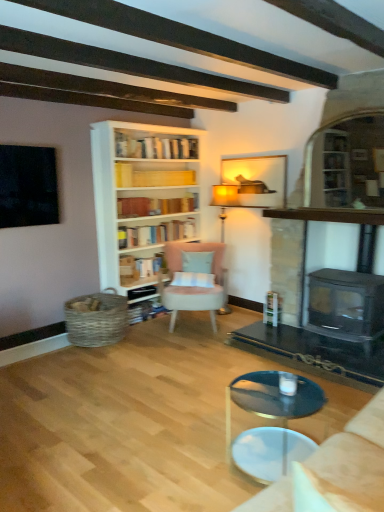
Measure the distance between point (50, 150) and camera.

The depth of point (50, 150) is 3.92 meters.

What is the approximate height of hardcover book at center, marked as the 3th book in a top-to-bottom arrangement?

The height of hardcover book at center, marked as the 3th book in a top-to-bottom arrangement, is 9.67 inches.

The image size is (384, 512). What are the coordinates of `hardcover book at center, marked as the 3th book in a top-to-bottom arrangement` in the screenshot? It's located at (140, 267).

The image size is (384, 512). Describe the element at coordinates (197, 261) in the screenshot. I see `light blue fabric pillow at center` at that location.

This screenshot has height=512, width=384. Find the location of `matte wooden picture frame at upper center`. matte wooden picture frame at upper center is located at coordinates 257,180.

What is the approximate width of woven brown picnic basket at lower left?

62.94 centimeters.

I want to click on pink fabric chair at center, so click(194, 287).

From the image's perspective, between hardcover book at center, placed as the 2th book when sorted from bottom to top, and beige fabric studio couch at lower right, which one is located above?

hardcover book at center, placed as the 2th book when sorted from bottom to top, appears higher in the image.

Identify the location of studio couch in front of the hardcover book at center, marked as the 3th book in a top-to-bottom arrangement. Image resolution: width=384 pixels, height=512 pixels. (352, 462).

Does point (144, 262) appear closer or farther from the camera than point (364, 509)?

Clearly, point (144, 262) is more distant from the camera than point (364, 509).

From a real-world perspective, who is located higher, light blue fabric pillow at center or hardcover book at center, marked as the 3th book in a top-to-bottom arrangement?

light blue fabric pillow at center is physically above.

From the image's perspective, relative to hardcover book at center, marked as the 3th book in a top-to-bottom arrangement, is light blue fabric pillow at center above or below?

Clearly, from the image's perspective, light blue fabric pillow at center is above hardcover book at center, marked as the 3th book in a top-to-bottom arrangement.

Would you say light blue fabric pillow at center is outside hardcover book at center, marked as the 3th book in a top-to-bottom arrangement?

Yes, light blue fabric pillow at center is located beyond the bounds of hardcover book at center, marked as the 3th book in a top-to-bottom arrangement.

This screenshot has height=512, width=384. In order to click on pillow on the right of hardcover book at center, placed as the 2th book when sorted from bottom to top in this screenshot , I will do `click(197, 261)`.

In the image, is matte wooden picture frame at upper center positioned in front of or behind matte black screen at upper left?

Visually, matte wooden picture frame at upper center is located behind matte black screen at upper left.

Can you confirm if matte wooden picture frame at upper center is shorter than matte black screen at upper left?

Correct, matte wooden picture frame at upper center is not as tall as matte black screen at upper left.

What are the coordinates of `picture frame behind the matte black screen at upper left` in the screenshot? It's located at (257, 180).

Based on their positions, is matte wooden picture frame at upper center located to the left or right of matte black screen at upper left?

Clearly, matte wooden picture frame at upper center is on the right of matte black screen at upper left in the image.

From a real-world perspective, between matte black screen at upper left and woven brown picnic basket at lower left, who is vertically higher?

In real-world perspective, matte black screen at upper left is above.

Which of these two, matte black screen at upper left or woven brown picnic basket at lower left, is wider?

With larger width is woven brown picnic basket at lower left.

Is matte black screen at upper left at the right side of woven brown picnic basket at lower left?

Incorrect, matte black screen at upper left is not on the right side of woven brown picnic basket at lower left.

Is matte black screen at upper left shorter than woven brown picnic basket at lower left?

No.

Is hardcover book at center, placed as the 2th book when sorted from bottom to top, positioned with its back to light blue fabric pillow at center?

No, hardcover book at center, placed as the 2th book when sorted from bottom to top, is not facing the opposite direction of light blue fabric pillow at center.

The height and width of the screenshot is (512, 384). Identify the location of book that is the 3rd object to the left of the light blue fabric pillow at center, starting at the anchor. (140, 267).

Which is more to the left, hardcover book at center, marked as the 3th book in a top-to-bottom arrangement, or light blue fabric pillow at center?

hardcover book at center, marked as the 3th book in a top-to-bottom arrangement.

Could you tell me if pink fabric chair at center is facing matte black screen at upper left?

No, pink fabric chair at center is not oriented towards matte black screen at upper left.

Does point (218, 286) appear closer or farther from the camera than point (9, 159)?

Point (218, 286) appears to be farther away from the viewer than point (9, 159).

From the picture: Would you say pink fabric chair at center contains matte black screen at upper left?

That's incorrect, matte black screen at upper left is not inside pink fabric chair at center.

Considering the sizes of objects matte wooden picture frame at upper center and woven brown picnic basket at lower left in the image provided, who is shorter, matte wooden picture frame at upper center or woven brown picnic basket at lower left?

woven brown picnic basket at lower left is shorter.

From a real-world perspective, who is located lower, matte wooden picture frame at upper center or woven brown picnic basket at lower left?

In real-world perspective, woven brown picnic basket at lower left is lower.

Is matte wooden picture frame at upper center positioned far away from woven brown picnic basket at lower left?

Absolutely, matte wooden picture frame at upper center is distant from woven brown picnic basket at lower left.

Is matte wooden picture frame at upper center thinner than woven brown picnic basket at lower left?

Yes, matte wooden picture frame at upper center is thinner than woven brown picnic basket at lower left.

Where is `book that is the 4th object located behind the beige fabric studio couch at lower right`? book that is the 4th object located behind the beige fabric studio couch at lower right is located at coordinates (140, 267).

From a real-world perspective, starting from the light blue fabric pillow at center, which book is the 1st one below it? Please provide its 2D coordinates.

[(140, 267)]

Based on their spatial positions, is hardcover book at center, which is the first book in bottom-to-top order, or matte black screen at upper left closer to beige fabric studio couch at lower right?

hardcover book at center, which is the first book in bottom-to-top order, is positioned closer to the anchor beige fabric studio couch at lower right.

Looking at this image, based on their spatial positions, is matte gold floor lamp at center or hardcover books at center, arranged as the second book when viewed from the top, closer to black glass fireplace at right?

matte gold floor lamp at center lies closer to black glass fireplace at right than the other object.

Which object lies further to the anchor point hardcover book at center, which is the fourth book from top to bottom, woven brown picnic basket at lower left or hardcover book at center, placed as the 2th book when sorted from bottom to top?

woven brown picnic basket at lower left is positioned further to the anchor hardcover book at center, which is the fourth book from top to bottom.

Estimate the real-world distances between objects in this image. Which object is closer to light blue fabric pillow at center, matte wooden picture frame at upper center or yellow paper at upper center, which is counted as the fourth book, starting from the bottom?

matte wooden picture frame at upper center is positioned closer to the anchor light blue fabric pillow at center.

Which object lies further to the anchor point hardcover book at center, which is the first book in bottom-to-top order, light blue fabric pillow at center or woven brown picnic basket at lower left?

light blue fabric pillow at center is positioned further to the anchor hardcover book at center, which is the first book in bottom-to-top order.

Looking at the image, which one is located closer to matte black screen at upper left, hardcover book at center, which is the first book in bottom-to-top order, or woven brown picnic basket at lower left?

woven brown picnic basket at lower left lies closer to matte black screen at upper left than the other object.

Considering their positions, is light blue fabric pillow at center positioned further to clear glass coffee table at center than matte wooden picture frame at upper center?

matte wooden picture frame at upper center lies further to clear glass coffee table at center than the other object.

From the image, which object appears to be farther from matte gold floor lamp at center, matte wooden picture frame at upper center or clear glass coffee table at center?

clear glass coffee table at center lies further to matte gold floor lamp at center than the other object.

Where is `picture frame located between clear glass coffee table at center and hardcover book at center, which is the first book in bottom-to-top order, in the depth direction`? The image size is (384, 512). picture frame located between clear glass coffee table at center and hardcover book at center, which is the first book in bottom-to-top order, in the depth direction is located at coordinates (257, 180).

Identify the location of book between yellow paper at upper center, arranged as the 1th book when viewed from the top, and hardcover book at center, placed as the 2th book when sorted from bottom to top, vertically. The height and width of the screenshot is (512, 384). (156, 233).

Where is `lamp situated between woven brown picnic basket at lower left and matte wooden picture frame at upper center from left to right`? This screenshot has height=512, width=384. lamp situated between woven brown picnic basket at lower left and matte wooden picture frame at upper center from left to right is located at coordinates (224, 201).

Locate an element on the screen. television between beige fabric studio couch at lower right and matte gold floor lamp at center along the z-axis is located at coordinates (28, 186).